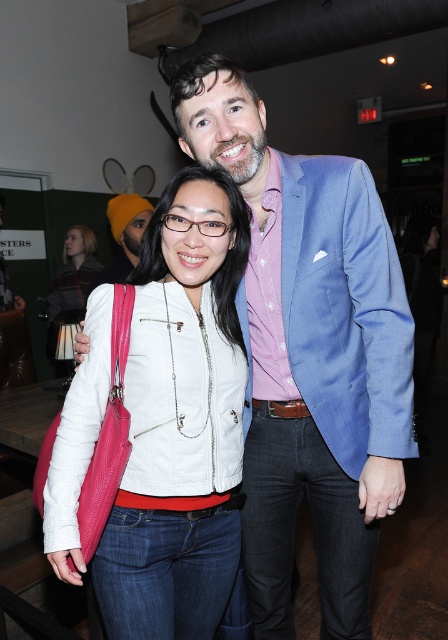
Does point (216, 509) lie behind point (151, 208)?

No, it is in front of (151, 208).

Is white leather jacket at center shorter than orange knit beanie at upper left?

No.

Image resolution: width=448 pixels, height=640 pixels. What do you see at coordinates (181, 422) in the screenshot?
I see `white leather jacket at center` at bounding box center [181, 422].

You are a GUI agent. You are given a task and a screenshot of the screen. Output one action in this format:
    pyautogui.click(x=<x>, y=<y>)
    Task: Click on the white leather jacket at center
    
    Given the screenshot: What is the action you would take?
    pyautogui.click(x=181, y=422)

Is leather jacket at center smaller than orange knit beanie at upper left?

Actually, leather jacket at center might be larger than orange knit beanie at upper left.

Which is above, leather jacket at center or orange knit beanie at upper left?

Positioned higher is orange knit beanie at upper left.

Which is behind, point (77, 312) or point (129, 248)?

The point (77, 312) is behind.

Locate an element on the screen. The image size is (448, 640). leather jacket at center is located at coordinates (70, 288).

Which is above, white leather jacket at center or leather jacket at center?

leather jacket at center is above.

Is the position of white leather jacket at center less distant than that of leather jacket at center?

Yes, white leather jacket at center is in front of leather jacket at center.

Between point (168, 627) and point (47, 298), which one is positioned behind?

The point (47, 298) is more distant.

In order to click on white leather jacket at center in this screenshot , I will do `click(181, 422)`.